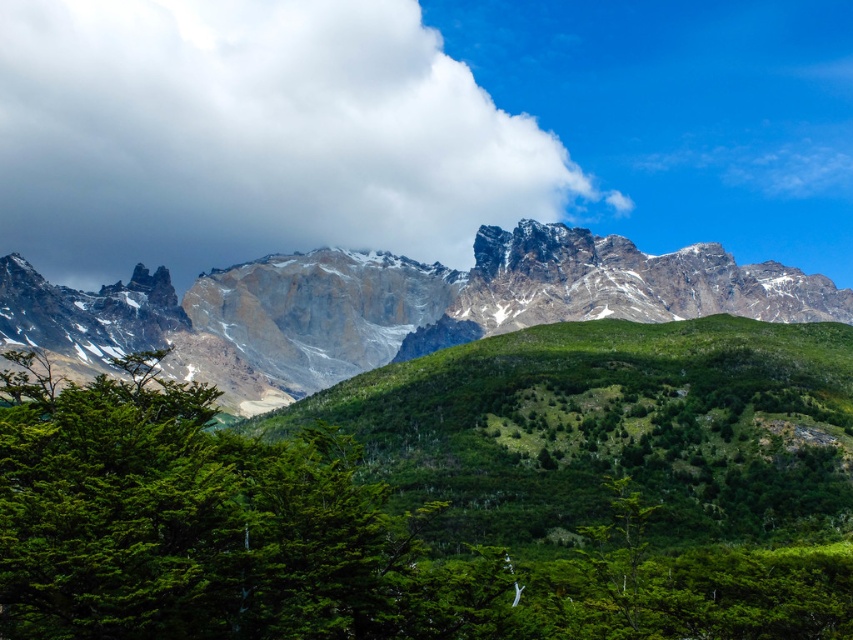
Question: Does white fluffy cloud at upper center have a lesser width compared to green grassy hillside at center?

Choices:
 (A) yes
 (B) no

Answer: (B)

Question: Is white fluffy cloud at upper center thinner than green grassy hillside at center?

Choices:
 (A) yes
 (B) no

Answer: (B)

Question: Is green leafy tree at center positioned before white fluffy cloud at upper center?

Choices:
 (A) no
 (B) yes

Answer: (B)

Question: Estimate the real-world distances between objects in this image. Which object is farther from the white fluffy cloud at upper center?

Choices:
 (A) rugged granite mountain range at center
 (B) green grassy hillside at center

Answer: (B)

Question: Among these points, which one is nearest to the camera?

Choices:
 (A) (395, 500)
 (B) (764, 609)

Answer: (B)

Question: Among these points, which one is farthest from the camera?

Choices:
 (A) (746, 493)
 (B) (22, 628)
 (C) (158, 22)
 (D) (785, 269)

Answer: (C)